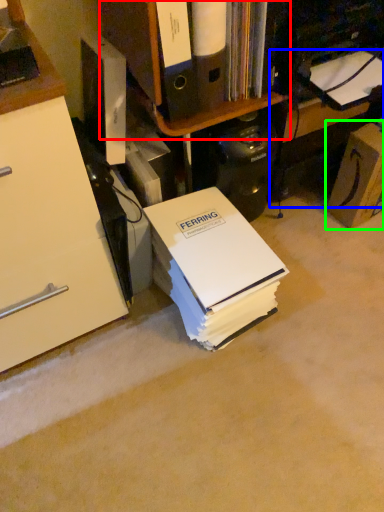
Question: Considering the real-world distances, which object is closest to shelf (highlighted by a red box)? computer desk (highlighted by a blue box) or cardboard box (highlighted by a green box).

Choices:
 (A) computer desk
 (B) cardboard box

Answer: (A)